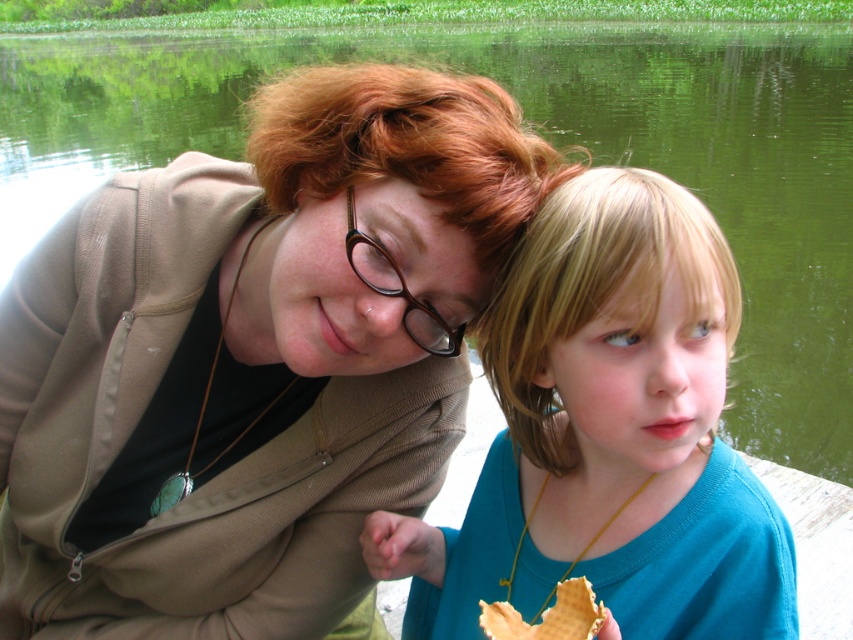
Question: Which object appears farthest from the camera in this image?

Choices:
 (A) blue matte shirt at center
 (B) waffle-like pastry at lower center

Answer: (A)

Question: From the image, what is the correct spatial relationship of matte brown jacket at center in relation to waffle-like pastry at lower center?

Choices:
 (A) above
 (B) below

Answer: (A)

Question: Can you confirm if matte brown jacket at center is wider than blue matte shirt at center?

Choices:
 (A) yes
 (B) no

Answer: (A)

Question: Estimate the real-world distances between objects in this image. Which object is farther from the blue matte shirt at center?

Choices:
 (A) brown plastic glasses at center
 (B) waffle-like pastry at lower center

Answer: (B)

Question: Considering the real-world distances, which object is closest to the blue matte shirt at center?

Choices:
 (A) waffle-like pastry at lower center
 (B) brown plastic glasses at center

Answer: (B)

Question: Does blue matte shirt at center have a greater width compared to waffle-like pastry at lower center?

Choices:
 (A) no
 (B) yes

Answer: (B)